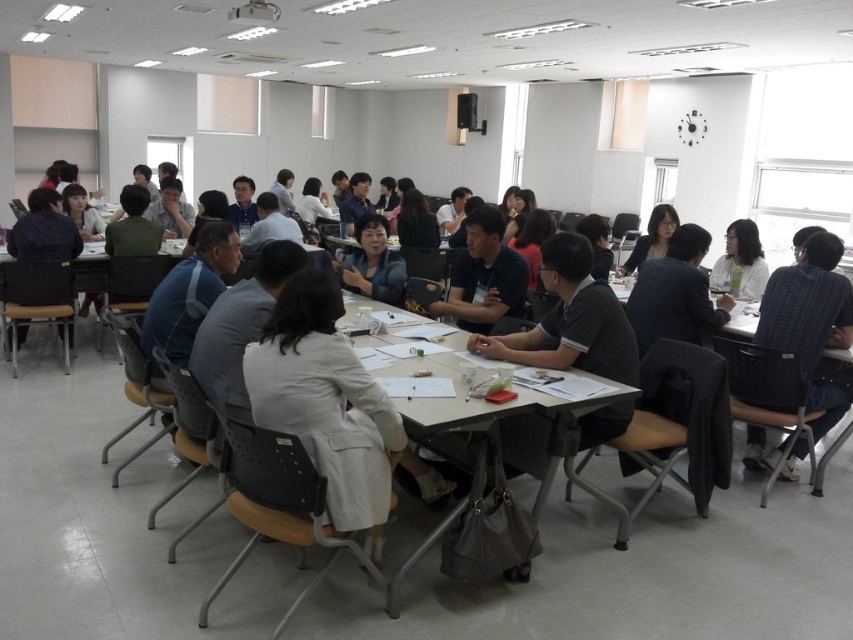
You are a participant in the conference room and notice the white paper at center and the light blue shirt at center. From your perspective, which object is positioned to the right?

The white paper at center is to the right of the light blue shirt at center.

Consider the image. You are organizing a seating arrangement for a conference and need to ensure that each attendee has enough space. You notice the light blue shirt at center and the matte black jacket at upper right. Which attendee requires more space for their seating area?

The matte black jacket at upper right requires more space because it occupies more area than the light blue shirt at center, as stated in the description.